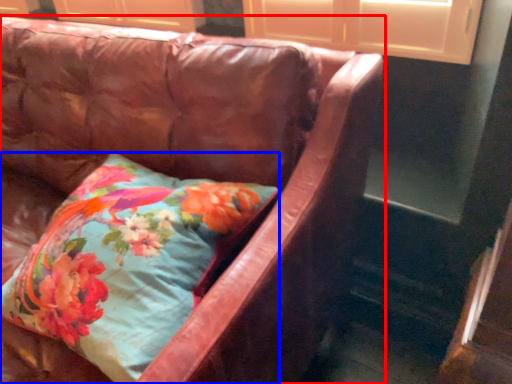
Question: Which object is further to the camera taking this photo, studio couch (highlighted by a red box) or pillow (highlighted by a blue box)?

Choices:
 (A) studio couch
 (B) pillow

Answer: (B)